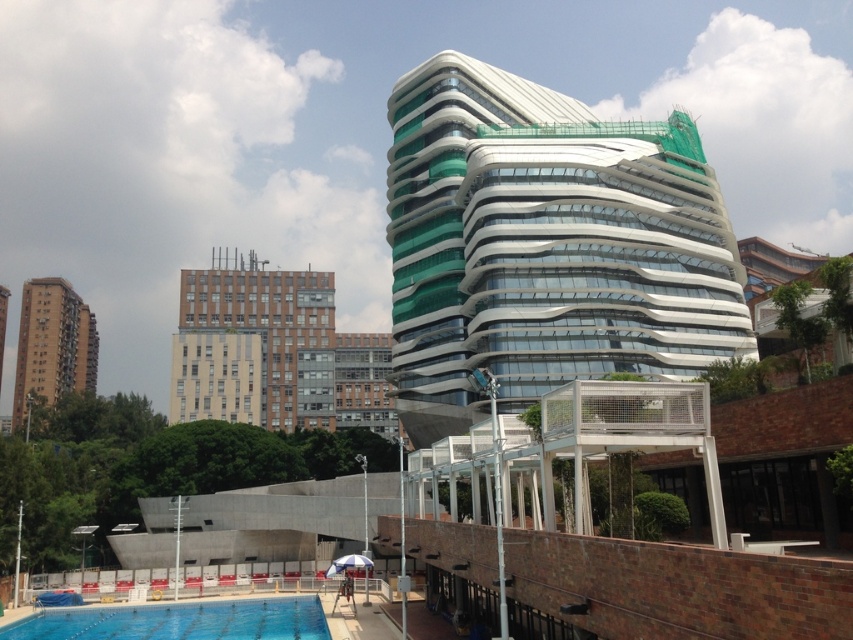
Question: Does white glass building at center have a smaller size compared to blue glass swimming pool at lower left?

Choices:
 (A) yes
 (B) no

Answer: (B)

Question: Estimate the real-world distances between objects in this image. Which object is closer to the brown brick building at upper left?

Choices:
 (A) blue glass swimming pool at lower left
 (B) brown concrete building at left
 (C) white glass building at center

Answer: (C)

Question: Which point is farther to the camera?

Choices:
 (A) white glass building at center
 (B) brown concrete building at left

Answer: (B)

Question: Does blue glass swimming pool at lower left have a greater width compared to brown concrete building at left?

Choices:
 (A) no
 (B) yes

Answer: (A)

Question: Does blue glass swimming pool at lower left appear on the right side of brown concrete building at left?

Choices:
 (A) yes
 (B) no

Answer: (A)

Question: Which point is closer to the camera?

Choices:
 (A) (310, 620)
 (B) (326, 388)
 (C) (28, 385)
 (D) (469, 298)

Answer: (A)